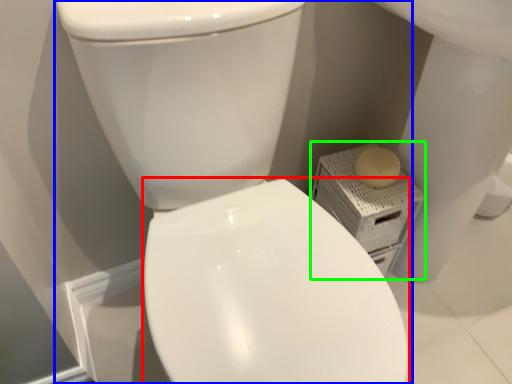
Question: Based on their relative distances, which object is farther from bidet (highlighted by a red box)? Choose from toilet (highlighted by a blue box) and porcelain (highlighted by a green box).

Choices:
 (A) toilet
 (B) porcelain

Answer: (B)